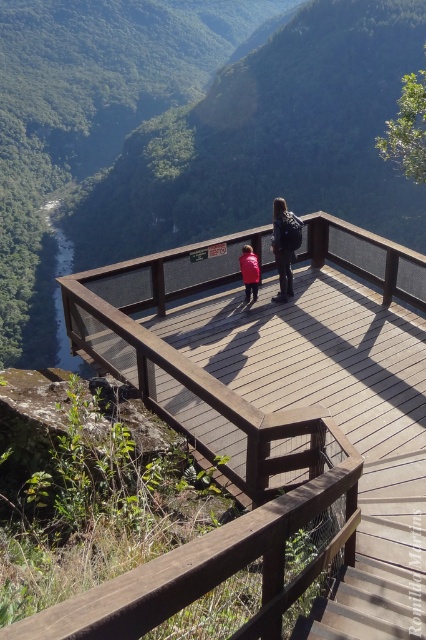
Who is more forward, (319,483) or (255,300)?

Point (319,483)

In the scene shown: Does brown wooden rail at lower left have a larger size compared to red matte jacket at center?

Indeed, brown wooden rail at lower left has a larger size compared to red matte jacket at center.

Who is more forward, (94, 600) or (244, 284)?

Point (94, 600)

At what (x,y) coordinates should I click in order to perform the action: click on brown wooden rail at lower left. Please return your answer as a coordinate pair (x, y). The image size is (426, 640). Looking at the image, I should click on (218, 560).

Is point (374, 292) farther from camera compared to point (198, 572)?

Yes, point (374, 292) is farther from viewer.

Is point (192, 330) less distant than point (109, 637)?

No, (192, 330) is behind (109, 637).

Find the location of a particular element. The height and width of the screenshot is (640, 426). brown wooden bridge at center is located at coordinates (275, 362).

What do you see at coordinates (189, 136) in the screenshot? The width and height of the screenshot is (426, 640). I see `green matte wooden platform at center` at bounding box center [189, 136].

Which is more to the right, green matte wooden platform at center or red matte jacket at center?

red matte jacket at center

Is point (287, 125) positioned behind point (249, 269)?

Yes.

Locate an element on the screen. green matte wooden platform at center is located at coordinates (189, 136).